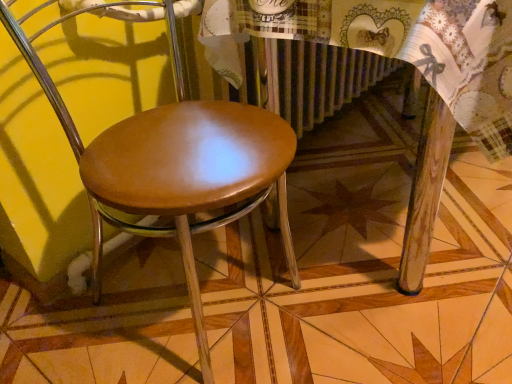
Find the location of a particular element. vacant space underneath shiny brown wood chair at center (from a real-world perspective) is located at coordinates (200, 301).